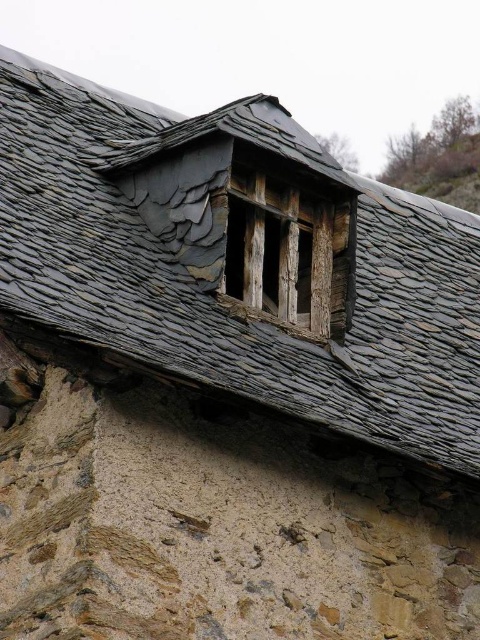
You are a contractor assessing the building. You need to install a new rectangular solar panel that is 1.2 meters wide. The panel must be placed on a surface that is wider than it. Can the gray slate roof at center or the weathered wood window at upper center accommodate the panel?

The gray slate roof at center might be wider than the weathered wood window at upper center. If the gray slate roof at center is indeed wider than 1.2 meters, it could accommodate the solar panel. However, the weathered wood window at upper center is likely narrower and may not be suitable. Check the exact width of the roof to confirm.

You are standing at a distance and looking at the gray slate roof at center. If you want to take a photo of it with a camera that has a maximum focus range of 40 meters, will you be able to capture it clearly?

The gray slate roof at center and camera are 42.91 meters apart, which exceeds the camera maximum focus range of 40 meters. So you won not be able to capture it clearly.

You are a repair worker assessing damage to the gray slate roof at center and the weathered wood window at upper center. Which object is positioned higher up on the building?

The gray slate roof at center is positioned higher up on the building than the weathered wood window at upper center, as it is located above it.